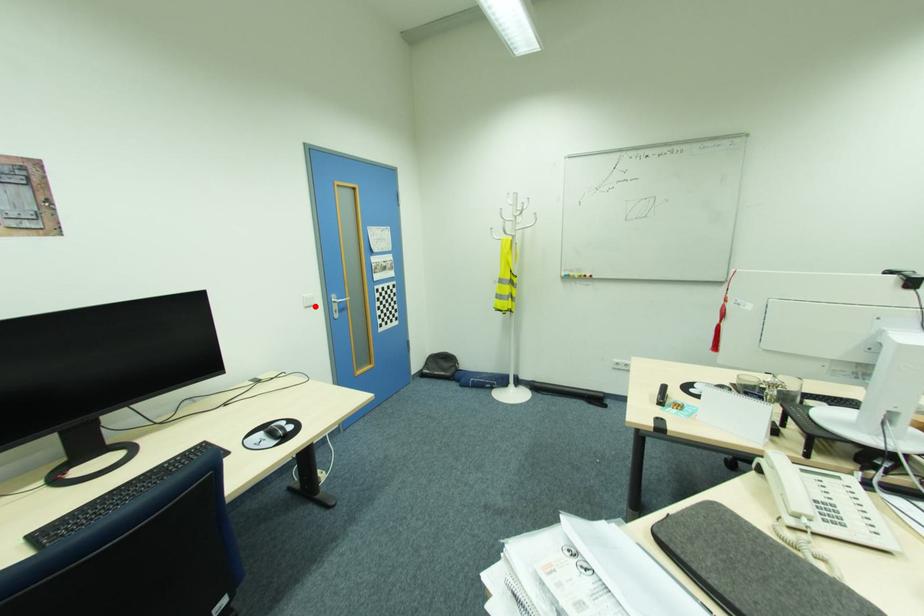
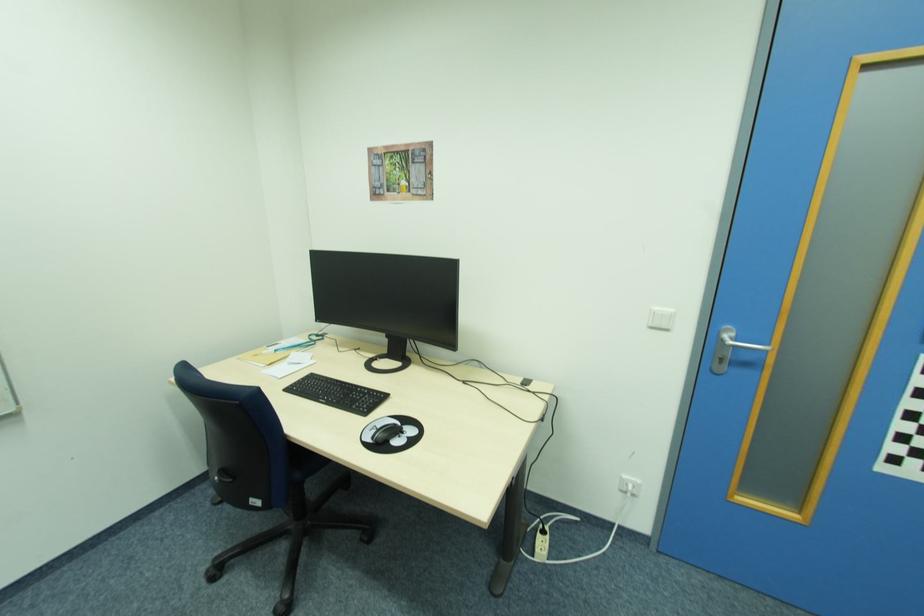
Find the pixel in the second image that matches the highlighted location in the first image.

(670, 329)